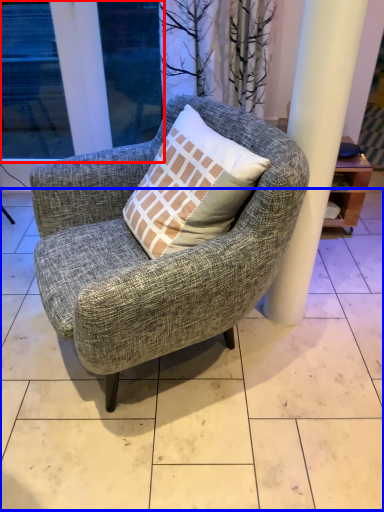
Question: Which object appears farthest to the camera in this image, window (highlighted by a red box) or tile (highlighted by a blue box)?

Choices:
 (A) window
 (B) tile

Answer: (A)